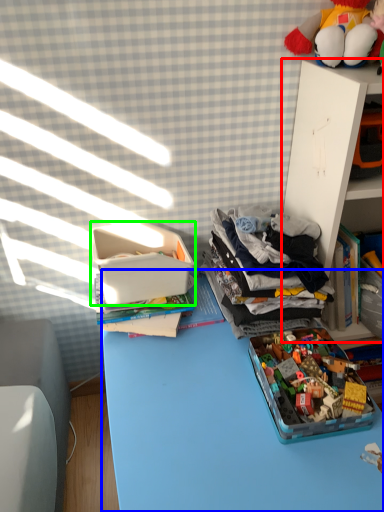
Question: Estimate the real-world distances between objects in this image. Which object is closer to shelf (highlighted by a red box), desk (highlighted by a blue box) or storage box (highlighted by a green box)?

Choices:
 (A) desk
 (B) storage box

Answer: (B)